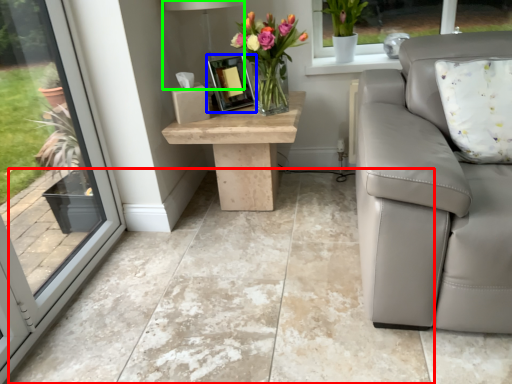
Question: Which object is the closest to the concrete (highlighted by a red box)? Choose among these: picture frame (highlighted by a blue box) or lamp (highlighted by a green box).

Choices:
 (A) picture frame
 (B) lamp

Answer: (A)